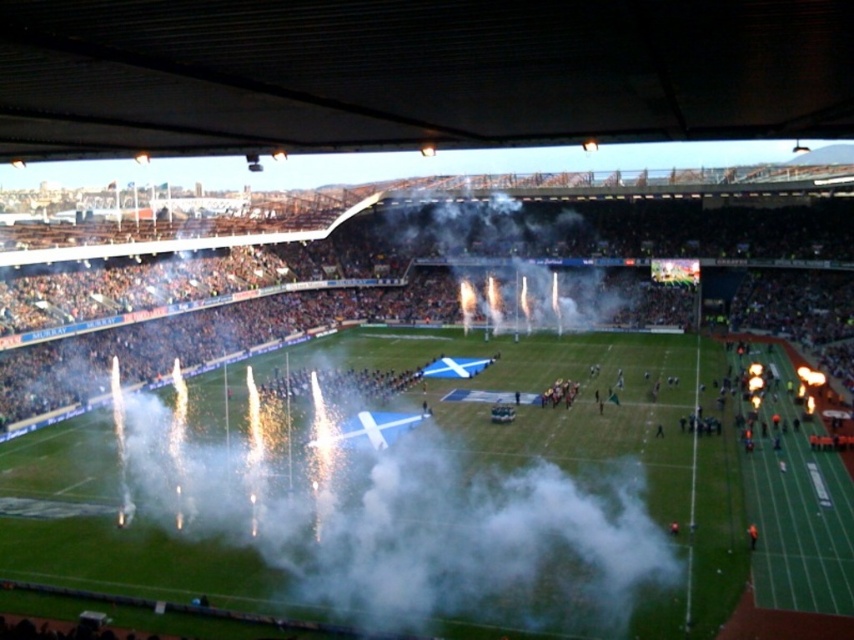
You are a safety officer at the rugby stadium and need to ensure that the crowd can see the field clearly. Given the presence of both the white fog at center and white smoke at center, which one is closer to the ground and might obstruct the view from the lower seats?

The white fog at center is below white smoke at center, so the white fog at center is closer to the ground and might obstruct the view from the lower seats.

You are a safety officer at the rugby stadium and need to ensure that the white fog at center and the white smoke at center do not obstruct the players. Based on the scene, which of these two elements is lower and therefore less likely to interfere with the players?

→ The white fog at center has a lesser height compared to the white smoke at center, making it less likely to obstruct the players.